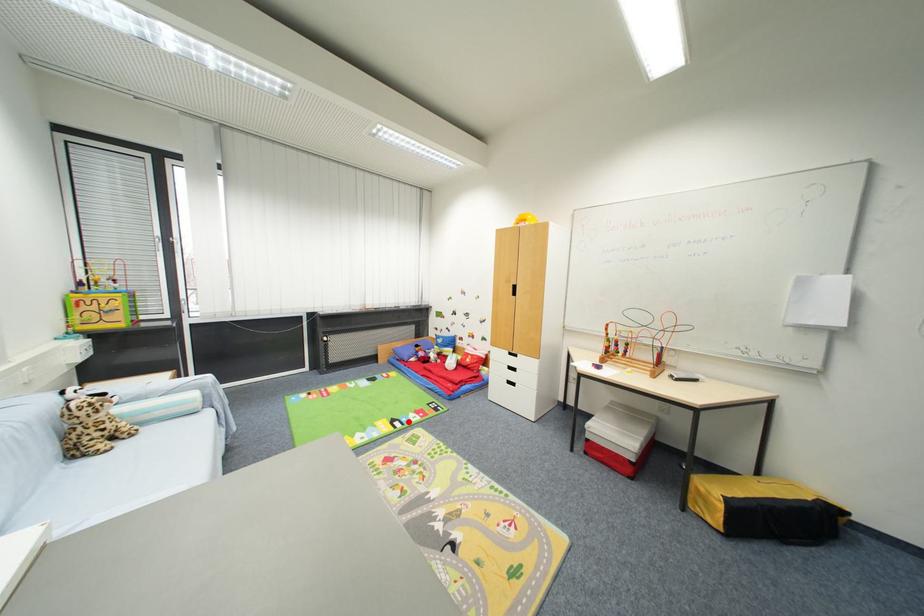
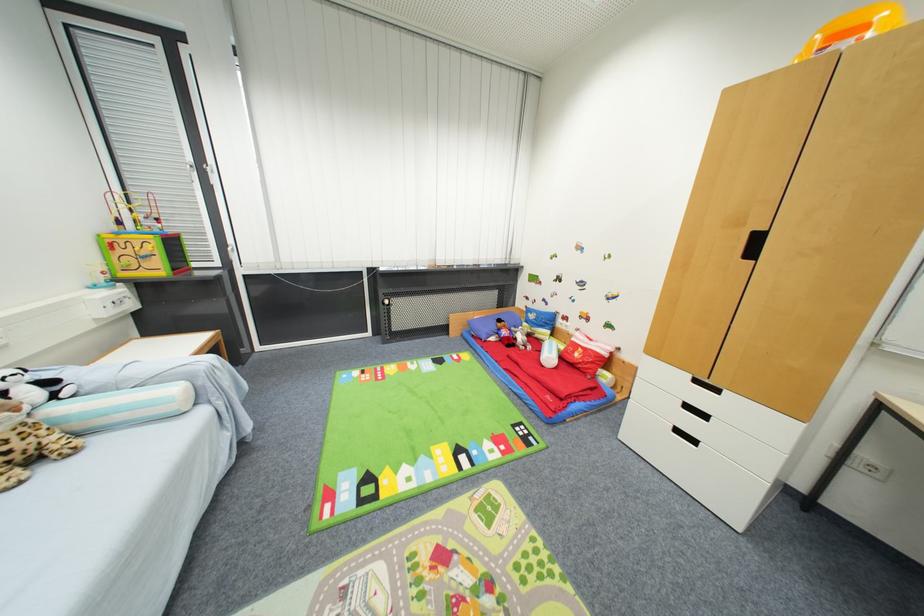
Locate, in the second image, the point that corresponds to the highlighted location in the first image.

(479, 455)